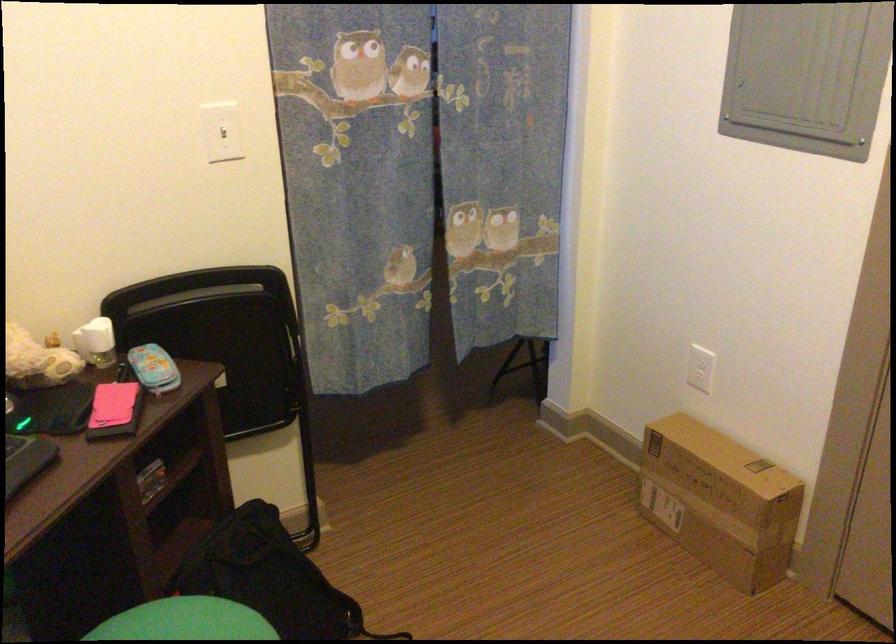
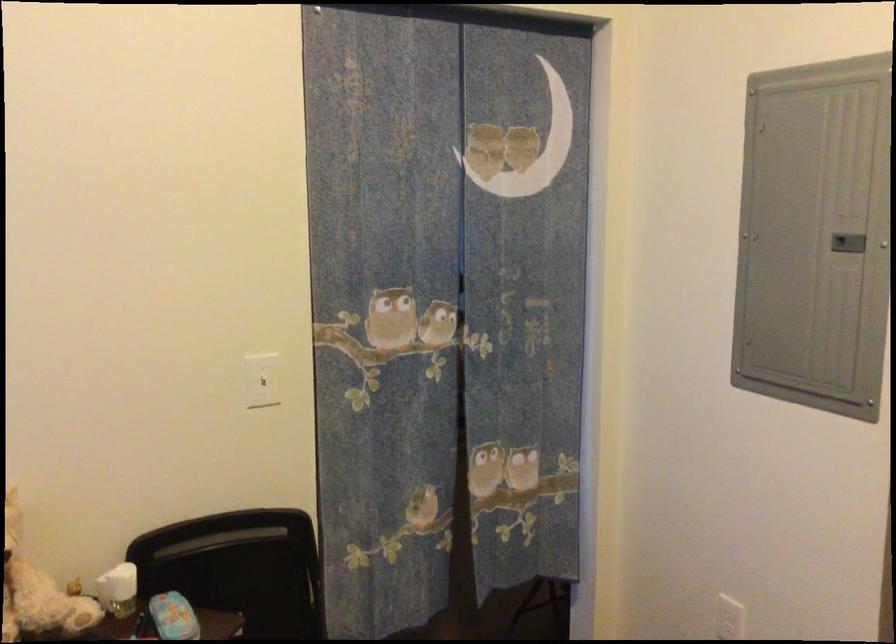
Question: How did the camera likely rotate?

Choices:
 (A) Left
 (B) Right
 (C) Up
 (D) Down

Answer: (C)